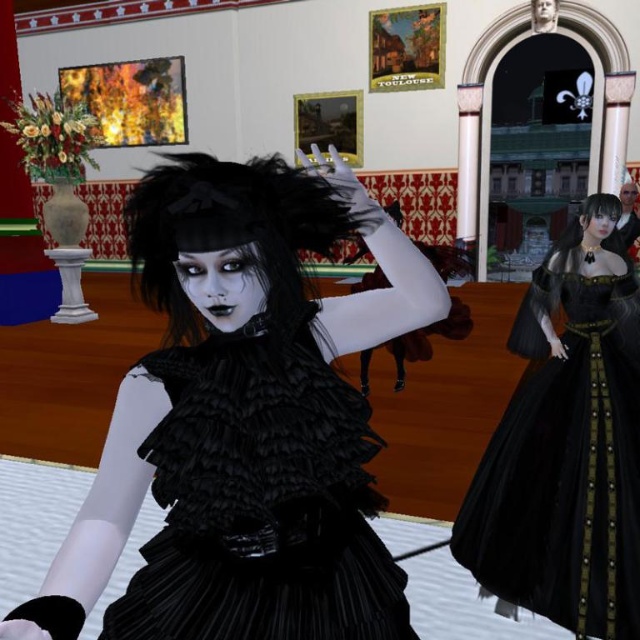
Which is above, matte black dress at center or black satin gown at right?

matte black dress at center

Can you confirm if matte black dress at center is positioned to the left of black satin gown at right?

Correct, you'll find matte black dress at center to the left of black satin gown at right.

Between point (198, 248) and point (604, 520), which one is positioned in front?

Point (198, 248)

The image size is (640, 640). What are the coordinates of `matte black dress at center` in the screenshot? It's located at (273, 248).